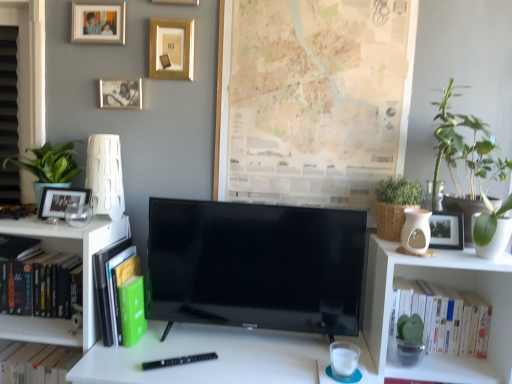
Find the location of a particular element. The width and height of the screenshot is (512, 384). vacant space that's between green matte book at left, placed as the 2th book when sorted from left to right, and black glossy tv at center is located at coordinates (214, 349).